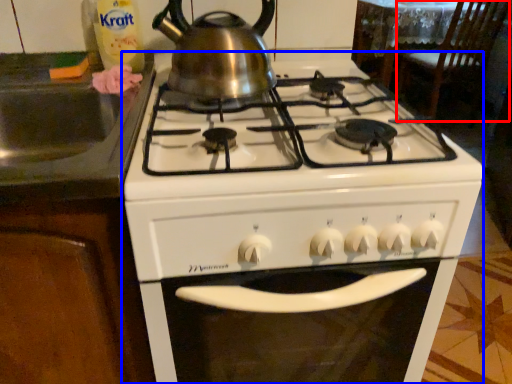
Question: Which point is closer to the camera, chair (highlighted by a red box) or gas stove (highlighted by a blue box)?

Choices:
 (A) chair
 (B) gas stove

Answer: (B)